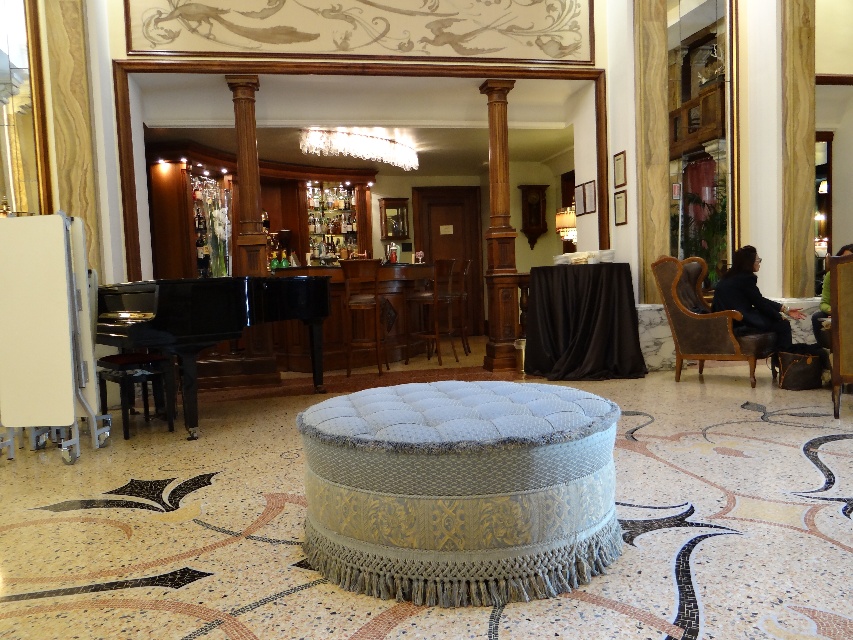
This screenshot has width=853, height=640. What do you see at coordinates (207, 317) in the screenshot?
I see `black polished piano at left` at bounding box center [207, 317].

Between black polished piano at left and white glass chandelier at upper center, which one is positioned lower?

black polished piano at left is lower down.

What do you see at coordinates (207, 317) in the screenshot? I see `black polished piano at left` at bounding box center [207, 317].

Identify the location of black polished piano at left. (207, 317).

Does white glass chandelier at upper center have a greater height compared to brown wooden bar stool at center?

No, white glass chandelier at upper center is not taller than brown wooden bar stool at center.

Does point (404, 163) come closer to viewer compared to point (360, 304)?

No, it is behind (360, 304).

Describe the element at coordinates (361, 145) in the screenshot. I see `white glass chandelier at upper center` at that location.

Where is `white glass chandelier at upper center`? This screenshot has width=853, height=640. white glass chandelier at upper center is located at coordinates (361, 145).

Looking at this image, can you confirm if black polished piano at left is bigger than brown leather armchair at center?

Yes.

Who is positioned more to the right, black polished piano at left or brown leather armchair at center?

From the viewer's perspective, brown leather armchair at center appears more on the right side.

Which is in front, point (184, 374) or point (451, 260)?

Point (184, 374) is more forward.

The width and height of the screenshot is (853, 640). Find the location of `black polished piano at left`. black polished piano at left is located at coordinates (207, 317).